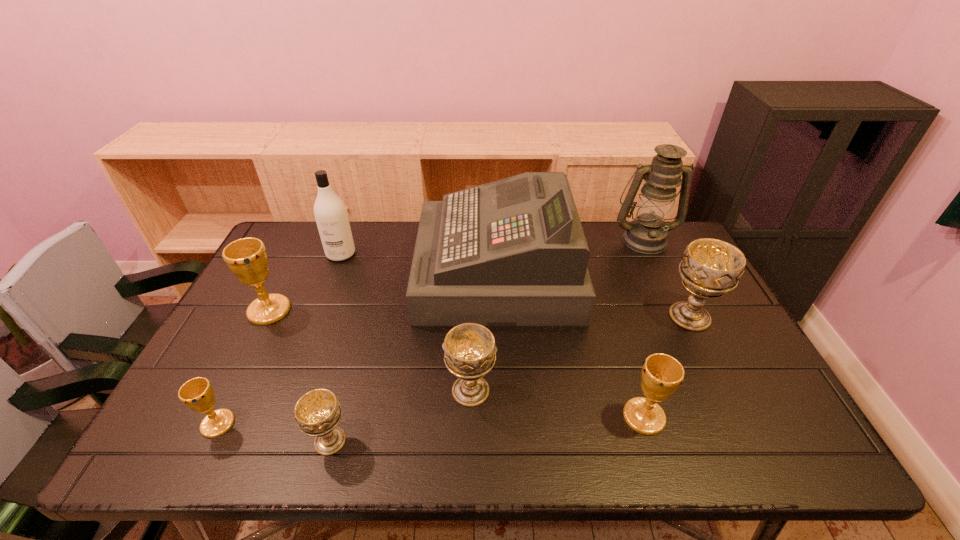
I want to click on object that is at the near left corner, so click(197, 393).

Identify the location of object that is at the far right corner. 647,234.

Where is `vacant area at the far edge`? vacant area at the far edge is located at coordinates (352, 231).

What are the coordinates of `vacant region at the near edge of the desktop` in the screenshot? It's located at (433, 453).

The image size is (960, 540). I want to click on free point at the left edge, so click(276, 285).

In the image, there is a desktop. Where is `vacant space at the right edge`? vacant space at the right edge is located at coordinates (715, 325).

The width and height of the screenshot is (960, 540). In the image, there is a desktop. In order to click on vacant space at the far left corner in this screenshot , I will do `click(308, 232)`.

Locate an element on the screen. free location at the near right corner of the desktop is located at coordinates (748, 456).

Identify the location of free area in between the rightmost white chalice and the oil lamp. (667, 278).

Where is `vacant area that lies between the seventh object from right to left and the smallest gold chalice`? The image size is (960, 540). vacant area that lies between the seventh object from right to left and the smallest gold chalice is located at coordinates (279, 339).